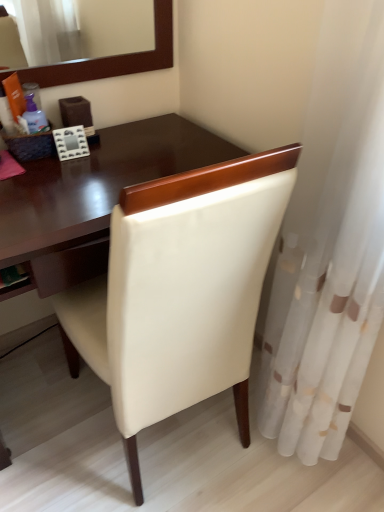
This screenshot has height=512, width=384. Find the location of `vacant space situated above white leather chair at center (from a real-world perspective)`. vacant space situated above white leather chair at center (from a real-world perspective) is located at coordinates (96, 167).